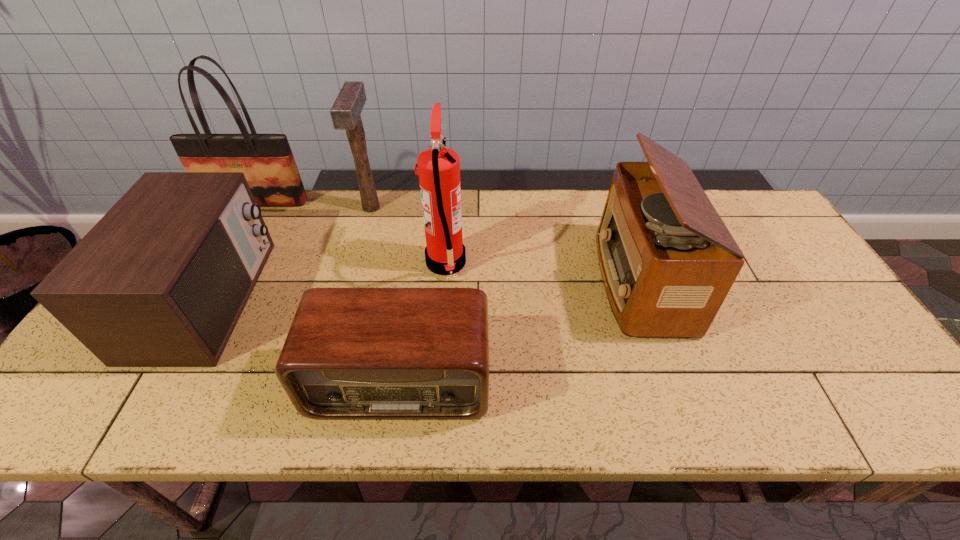
Where is `shopping bag`? This screenshot has width=960, height=540. shopping bag is located at coordinates (266, 160).

The width and height of the screenshot is (960, 540). Find the location of `fire extinguisher`. fire extinguisher is located at coordinates (438, 167).

Locate an element on the screen. The height and width of the screenshot is (540, 960). mallet is located at coordinates (345, 112).

Locate an element on the screen. the rightmost object is located at coordinates (667, 261).

The height and width of the screenshot is (540, 960). In order to click on the tallest radio receiver in this screenshot , I will do `click(667, 261)`.

The width and height of the screenshot is (960, 540). I want to click on the second shortest object, so point(161,280).

In order to click on the second shortest radio receiver in this screenshot , I will do `click(161, 280)`.

Where is `the second radio receiver from left to right`? the second radio receiver from left to right is located at coordinates (351, 353).

Identify the location of the shortest object. This screenshot has width=960, height=540. (351, 353).

Locate an element on the screen. This screenshot has height=540, width=960. vacant space located on the front-facing side of the shopping bag is located at coordinates (203, 295).